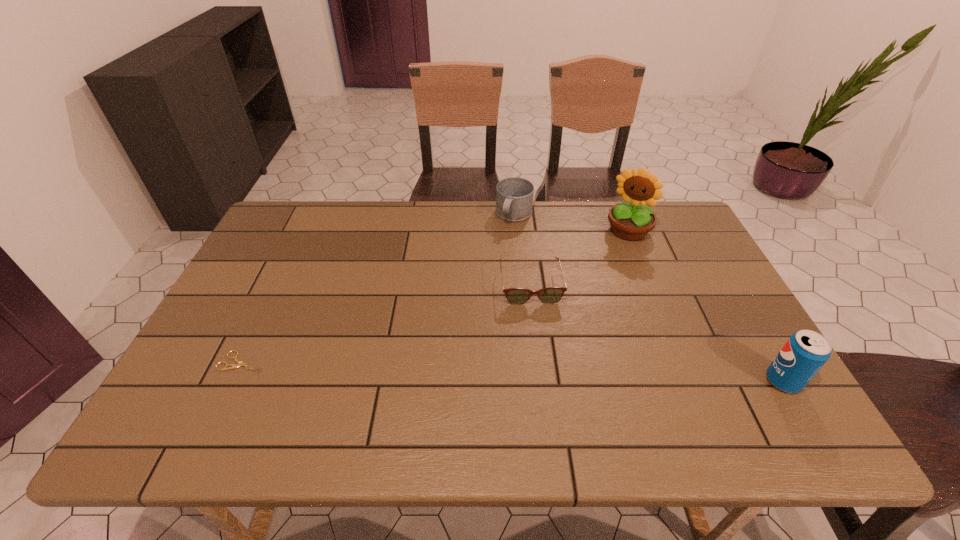
Image resolution: width=960 pixels, height=540 pixels. I want to click on sunflower present at the far edge, so click(632, 220).

You are a GUI agent. You are given a task and a screenshot of the screen. Output one action in this format:
    pyautogui.click(x=<x>, y=<y>)
    Task: Click on the mug that is positioned at the far edge
    
    Given the screenshot: What is the action you would take?
    pyautogui.click(x=514, y=196)

You are a GUI agent. You are given a task and a screenshot of the screen. Output one action in this format:
    pyautogui.click(x=<x>, y=<y>)
    Task: Click on the shears that is positioned at the near edge
    This screenshot has width=960, height=540.
    Given the screenshot: What is the action you would take?
    pyautogui.click(x=240, y=363)

At what (x,y) coordinates should I click in order to perform the action: click on soda can at the near edge. Please return your answer as a coordinate pair (x, y). The image size is (960, 540). Looking at the image, I should click on (806, 351).

Locate an element on the screen. The height and width of the screenshot is (540, 960). object that is at the left edge is located at coordinates (240, 363).

Where is `soda can at the right edge`? The image size is (960, 540). soda can at the right edge is located at coordinates (806, 351).

Locate an element on the screen. sunflower that is at the right edge is located at coordinates (632, 220).

The height and width of the screenshot is (540, 960). What are the coordinates of `object present at the near left corner` in the screenshot? It's located at (240, 363).

In order to click on object that is positioned at the far right corner in this screenshot , I will do `click(632, 220)`.

What are the coordinates of `object that is at the near right corner` in the screenshot? It's located at (806, 351).